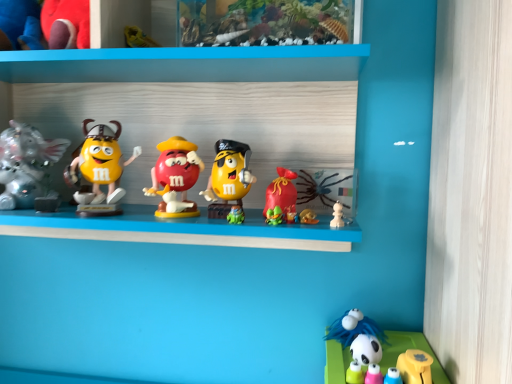
You are a GUI agent. You are given a task and a screenshot of the screen. Output one action in this format:
    pyautogui.click(x=<x>, y=<y>)
    Task: Click on the blank space above white glossy panda at lower right (from a real-world perspective)
    The height and width of the screenshot is (384, 512).
    Given the screenshot: What is the action you would take?
    pyautogui.click(x=387, y=351)